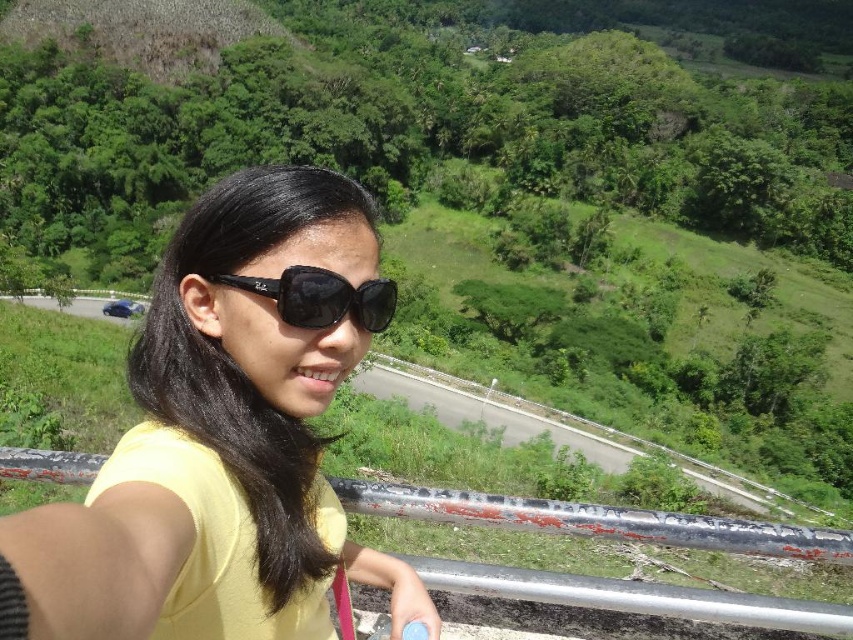
Question: Which of the following is the farthest from the observer?

Choices:
 (A) rusty metal rail at center
 (B) gray asphalt road at center

Answer: (B)

Question: From the image, what is the correct spatial relationship of yellow matte shirt at center in relation to gray asphalt road at center?

Choices:
 (A) left
 (B) right

Answer: (A)

Question: Where is yellow matte shirt at center located in relation to rusty metal rail at center in the image?

Choices:
 (A) below
 (B) above

Answer: (B)

Question: Which point is closer to the camera?

Choices:
 (A) (427, 378)
 (B) (577, 580)

Answer: (B)

Question: Can you confirm if yellow matte shirt at center is positioned below black reflective sunglasses at center?

Choices:
 (A) no
 (B) yes

Answer: (B)

Question: Among these objects, which one is farthest from the camera?

Choices:
 (A) black reflective sunglasses at center
 (B) rusty metal rail at center
 (C) yellow matte shirt at center

Answer: (B)